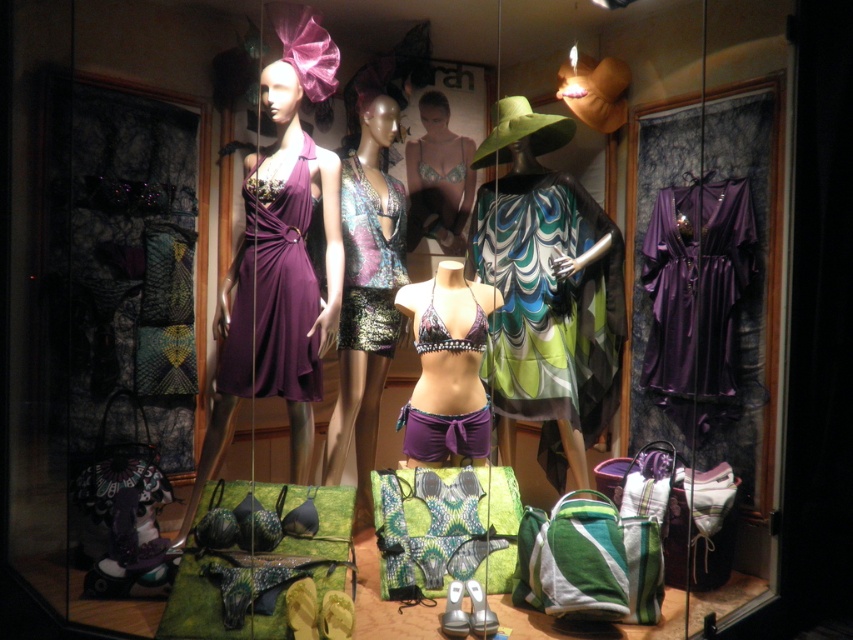
Who is more forward, (717, 275) or (413, 154)?

Point (717, 275) is more forward.

Locate an element on the screen. This screenshot has width=853, height=640. satin purple dress at right is located at coordinates (697, 300).

Is point (720, 412) farther from camera compared to point (450, 173)?

No, (720, 412) is in front of (450, 173).

Find the location of a particular element. satin purple dress at right is located at coordinates (x=697, y=300).

Is satin purple dress at right to the left of matte black bikini at center from the viewer's perspective?

In fact, satin purple dress at right is to the right of matte black bikini at center.

Consider the image. Does satin purple dress at right have a lesser height compared to matte black bikini at center?

In fact, satin purple dress at right may be taller than matte black bikini at center.

This screenshot has width=853, height=640. I want to click on satin purple dress at right, so click(697, 300).

Which is below, matte purple dress at left or purple satin bikini bottom at center?

Positioned lower is purple satin bikini bottom at center.

Where is `matte purple dress at left`? matte purple dress at left is located at coordinates (280, 259).

Find the location of a particular element. The height and width of the screenshot is (640, 853). matte purple dress at left is located at coordinates (280, 259).